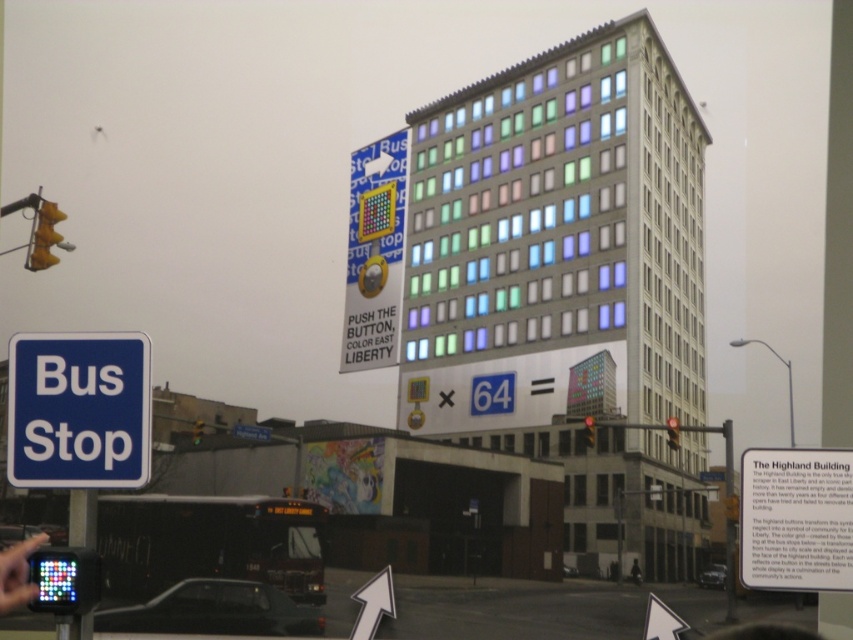
Between yellow plastic traffic light at upper left and blue plastic bus stop sign at lower left, which one appears on the left side from the viewer's perspective?

Positioned to the left is yellow plastic traffic light at upper left.

Is yellow plastic traffic light at upper left shorter than blue plastic bus stop sign at lower left?

No, yellow plastic traffic light at upper left is not shorter than blue plastic bus stop sign at lower left.

Who is more distant from viewer, (38, 260) or (268, 435)?

Positioned behind is point (38, 260).

Find the location of a particular element. Image resolution: width=853 pixels, height=640 pixels. yellow plastic traffic light at upper left is located at coordinates (44, 234).

Which of these two, blue plastic bus stop at lower left or red glass traffic light at upper right, stands taller?

Standing taller between the two is blue plastic bus stop at lower left.

The width and height of the screenshot is (853, 640). Find the location of `blue plastic bus stop at lower left`. blue plastic bus stop at lower left is located at coordinates (78, 410).

Image resolution: width=853 pixels, height=640 pixels. What are the coordinates of `blue plastic bus stop at lower left` in the screenshot? It's located at [x=78, y=410].

Is point (192, 428) positioned after point (637, 570)?

Yes, point (192, 428) is behind point (637, 570).

Who is taller, yellow matte traffic light at upper left or black matte person at lower right?

yellow matte traffic light at upper left is taller.

This screenshot has width=853, height=640. What do you see at coordinates (196, 429) in the screenshot?
I see `yellow matte traffic light at upper left` at bounding box center [196, 429].

Identify the location of yellow matte traffic light at upper left. This screenshot has width=853, height=640. (196, 429).